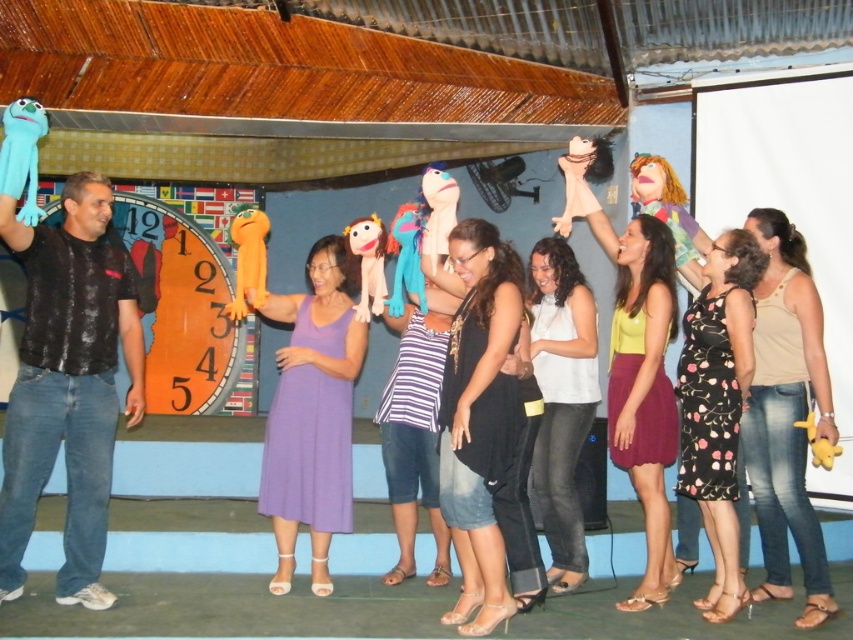
Question: Which point appears closest to the camera in this image?

Choices:
 (A) (490, 419)
 (B) (332, 440)
 (C) (379, 241)

Answer: (A)

Question: Can you confirm if black dotted dress at center is positioned above soft plush puppet at center?

Choices:
 (A) no
 (B) yes

Answer: (A)

Question: Is matte pink doll at upper right to the right of orange plush at center from the viewer's perspective?

Choices:
 (A) no
 (B) yes

Answer: (B)

Question: Which object is closer to the camera taking this photo?

Choices:
 (A) multicolored fabric puppet at upper center
 (B) matte yellow blouse at center
 (C) matte pink doll at upper right
 (D) soft plush puppet at center

Answer: (B)

Question: Can you confirm if tan fabric tank top at right is smaller than white matte shirt at center?

Choices:
 (A) yes
 (B) no

Answer: (B)

Question: Which point is farther from the camera taking this photo?

Choices:
 (A) (351, 374)
 (B) (805, 413)

Answer: (A)